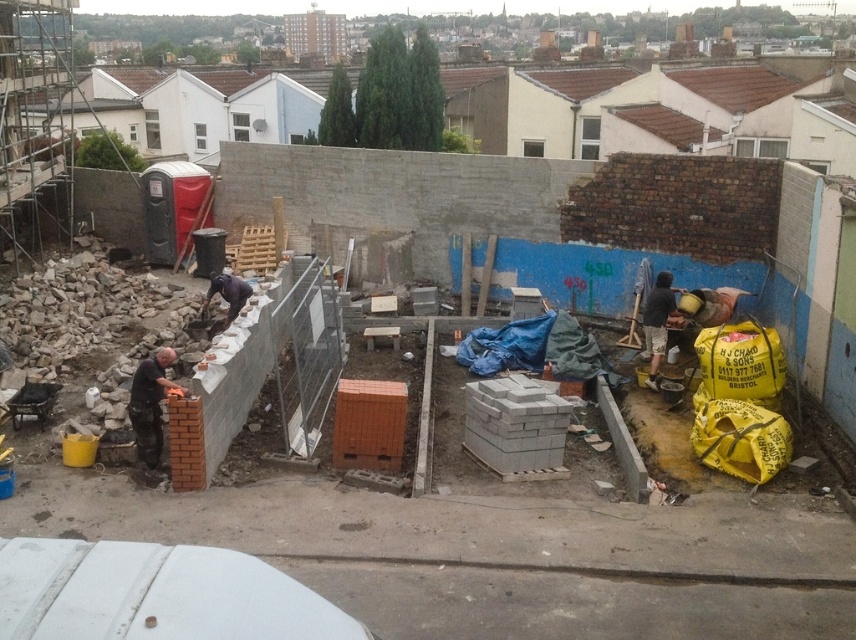
Question: Which point appears farthest from the camera in this image?

Choices:
 (A) (245, 301)
 (B) (141, 401)

Answer: (A)

Question: Can you confirm if matte black t-shirt at left is smaller than dark brown leather jacket at center?

Choices:
 (A) yes
 (B) no

Answer: (B)

Question: Which point appears farthest from the camera in this image?

Choices:
 (A) (233, 284)
 (B) (664, 296)
 (C) (150, 440)

Answer: (A)

Question: Is matte black t-shirt at left further to the viewer compared to dark brown leather jacket at center?

Choices:
 (A) no
 (B) yes

Answer: (A)

Question: Which object is positioned closest to the dark gray fabric shirt at right?

Choices:
 (A) dark brown leather jacket at center
 (B) matte black t-shirt at left

Answer: (A)

Question: Is matte black t-shirt at left closer to the viewer compared to dark gray fabric shirt at right?

Choices:
 (A) yes
 (B) no

Answer: (A)